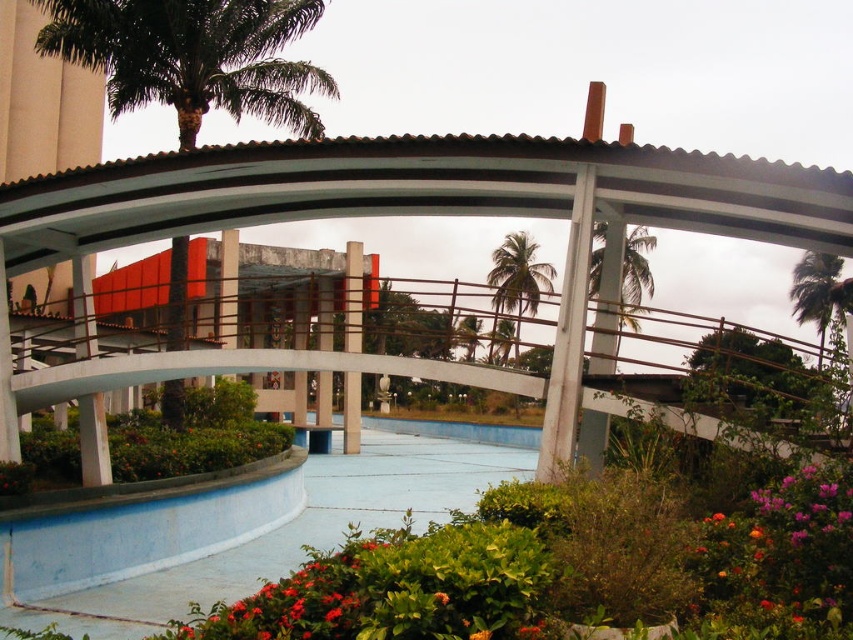
Does white concrete bridge at center come in front of vivid red petals at lower center?

No.

Can you confirm if white concrete bridge at center is positioned to the right of vivid red petals at lower center?

No, white concrete bridge at center is not to the right of vivid red petals at lower center.

The width and height of the screenshot is (853, 640). What do you see at coordinates (421, 212) in the screenshot?
I see `white concrete bridge at center` at bounding box center [421, 212].

This screenshot has width=853, height=640. What are the coordinates of `white concrete bridge at center` in the screenshot? It's located at (421, 212).

Is white concrete bridge at center taller than green leafy palm tree at center?

No, white concrete bridge at center is not taller than green leafy palm tree at center.

How much distance is there between white concrete bridge at center and green leafy palm tree at center?

6.48 meters

Between point (1, 236) and point (613, 301), which one is positioned behind?

The point (1, 236) is more distant.

At what (x,y) coordinates should I click in order to perform the action: click on white concrete bridge at center. Please return your answer as a coordinate pair (x, y). Looking at the image, I should click on (421, 212).

Which is more to the left, white concrete bridge at center or green leafy palm tree at upper left?

green leafy palm tree at upper left

Which is more to the right, white concrete bridge at center or green leafy palm tree at upper left?

Positioned to the right is white concrete bridge at center.

The width and height of the screenshot is (853, 640). Describe the element at coordinates (421, 212) in the screenshot. I see `white concrete bridge at center` at that location.

You are a GUI agent. You are given a task and a screenshot of the screen. Output one action in this format:
    pyautogui.click(x=<x>, y=<y>)
    Task: Click on the white concrete bridge at center
    The width and height of the screenshot is (853, 640).
    Given the screenshot: What is the action you would take?
    pyautogui.click(x=421, y=212)